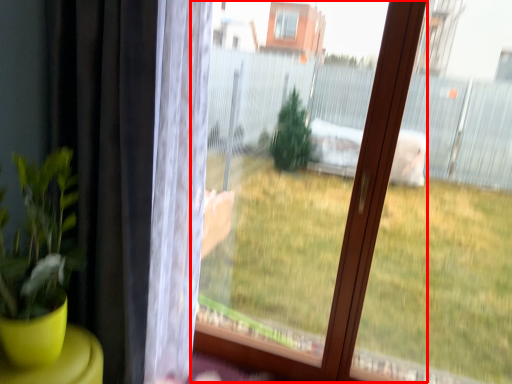
Question: From the image's perspective, what is the correct spatial positioning of bay window (annotated by the red box) in reference to curtain?

Choices:
 (A) below
 (B) above

Answer: (A)